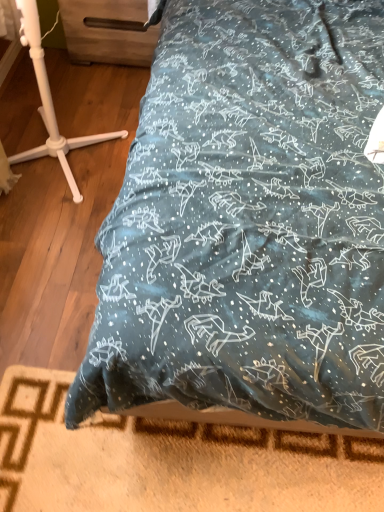
Question: Is teal fabric bed at center touching wooden bed frame at lower center?

Choices:
 (A) no
 (B) yes

Answer: (A)

Question: From the image's perspective, is teal fabric bed at center over wooden bed frame at lower center?

Choices:
 (A) no
 (B) yes

Answer: (B)

Question: Are teal fabric bed at center and wooden bed frame at lower center located far from each other?

Choices:
 (A) no
 (B) yes

Answer: (A)

Question: Is wooden bed frame at lower center located within teal fabric bed at center?

Choices:
 (A) yes
 (B) no

Answer: (A)

Question: Is teal fabric bed at center closer to camera compared to wooden bed frame at lower center?

Choices:
 (A) no
 (B) yes

Answer: (B)

Question: Is teal fabric bed at center smaller than wooden bed frame at lower center?

Choices:
 (A) yes
 (B) no

Answer: (B)

Question: Is the depth of wooden bed frame at lower center greater than that of white plastic tripod at left?

Choices:
 (A) no
 (B) yes

Answer: (B)

Question: Considering the relative positions of wooden bed frame at lower center and white plastic tripod at left in the image provided, is wooden bed frame at lower center to the right of white plastic tripod at left from the viewer's perspective?

Choices:
 (A) yes
 (B) no

Answer: (A)

Question: Does wooden bed frame at lower center have a lesser width compared to white plastic tripod at left?

Choices:
 (A) yes
 (B) no

Answer: (A)

Question: From the image's perspective, does wooden bed frame at lower center appear lower than white plastic tripod at left?

Choices:
 (A) yes
 (B) no

Answer: (A)

Question: Could you tell me if wooden bed frame at lower center is turned towards white plastic tripod at left?

Choices:
 (A) no
 (B) yes

Answer: (A)

Question: Does wooden bed frame at lower center have a lesser height compared to white plastic tripod at left?

Choices:
 (A) yes
 (B) no

Answer: (A)

Question: Is white plastic tripod at left further to camera compared to wooden drawer at upper left?

Choices:
 (A) yes
 (B) no

Answer: (B)